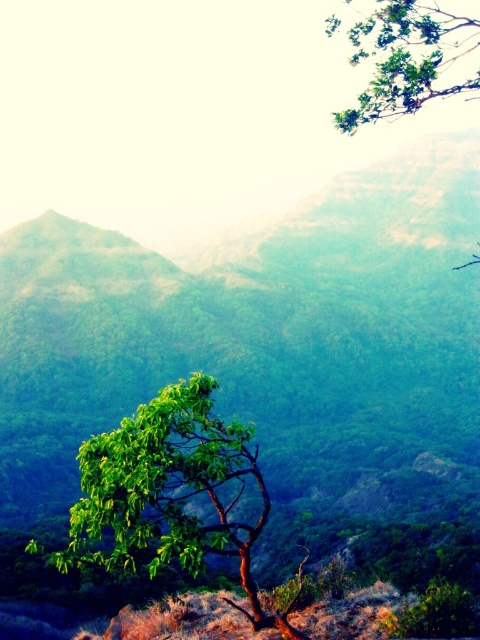
Question: Can you confirm if green leafy tree at center is positioned to the right of green leafy tree at upper right?

Choices:
 (A) no
 (B) yes

Answer: (A)

Question: Among these points, which one is nearest to the camera?

Choices:
 (A) (222, 516)
 (B) (379, 60)

Answer: (A)

Question: Is green leafy tree at center to the left of green leafy tree at upper right from the viewer's perspective?

Choices:
 (A) no
 (B) yes

Answer: (B)

Question: Is green leafy tree at center to the right of green leafy tree at upper right from the viewer's perspective?

Choices:
 (A) yes
 (B) no

Answer: (B)